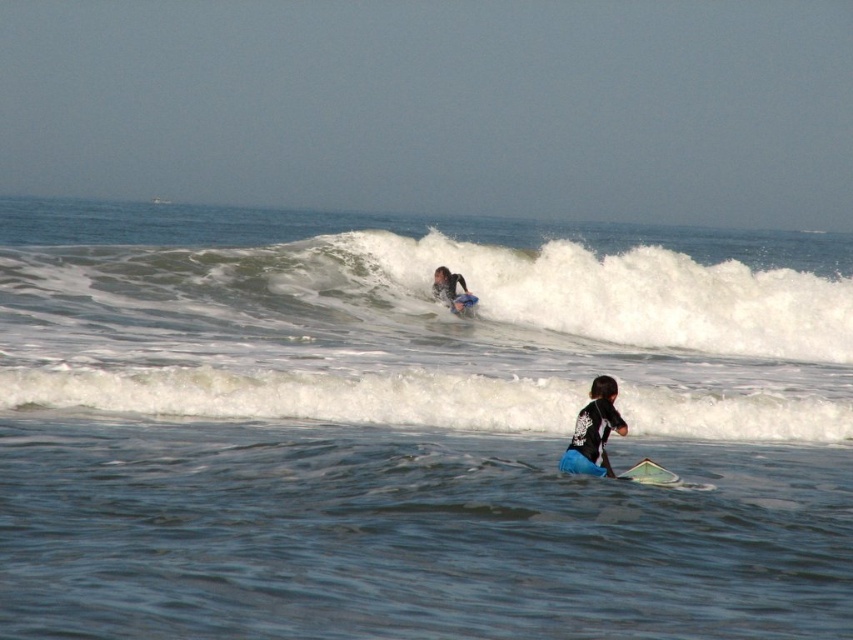
Question: Which object appears closest to the camera in this image?

Choices:
 (A) white frothy wave at upper center
 (B) blue water at wave center

Answer: (B)

Question: Is white frothy wave at upper center to the left of white foam surfboard at upper center from the viewer's perspective?

Choices:
 (A) no
 (B) yes

Answer: (B)

Question: Is blue water at wave center to the right of black wetsuit at lower center from the viewer's perspective?

Choices:
 (A) yes
 (B) no

Answer: (A)

Question: Among these objects, which one is nearest to the camera?

Choices:
 (A) white foam surfboard at lower center
 (B) blue rubber paddle at lower center
 (C) blue water at wave center
 (D) white foam surfboard at upper center

Answer: (C)

Question: Which object appears farthest from the camera in this image?

Choices:
 (A) blue water at wave center
 (B) blue rubber paddle at lower center
 (C) black wetsuit at lower center

Answer: (B)

Question: Does black wetsuit at lower center have a lesser width compared to dark blue wetsuit at upper center?

Choices:
 (A) yes
 (B) no

Answer: (A)